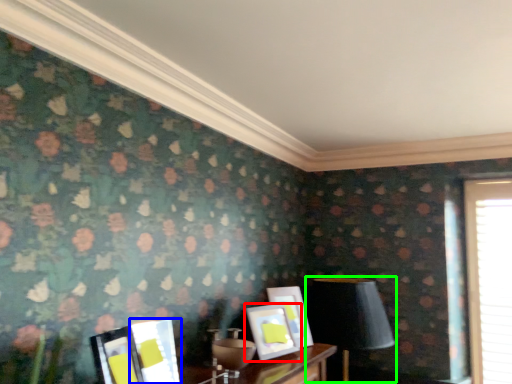
Question: Considering the real-world distances, which object is farthest from picture frame (highlighted by a red box)? picture frame (highlighted by a blue box) or table lamp (highlighted by a green box)?

Choices:
 (A) picture frame
 (B) table lamp

Answer: (A)